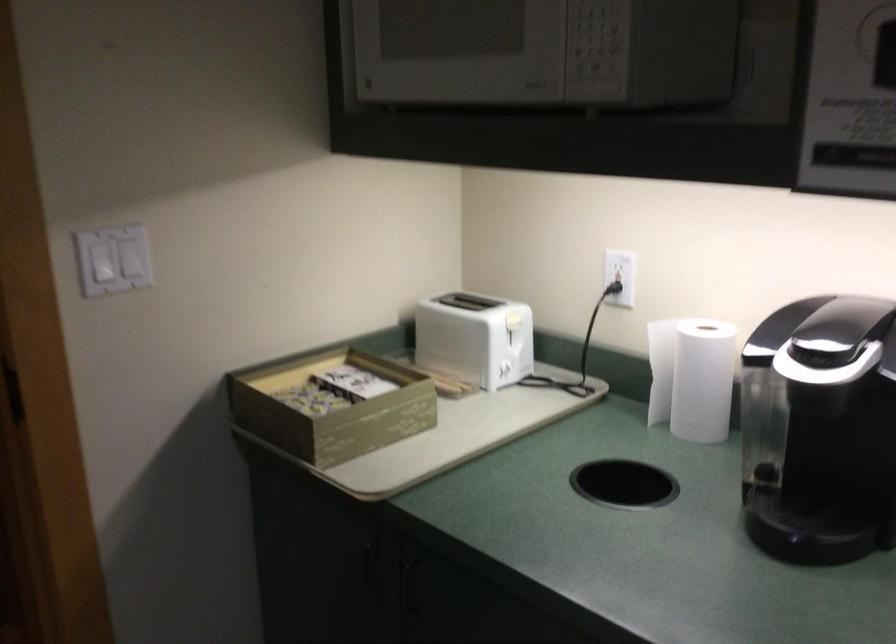
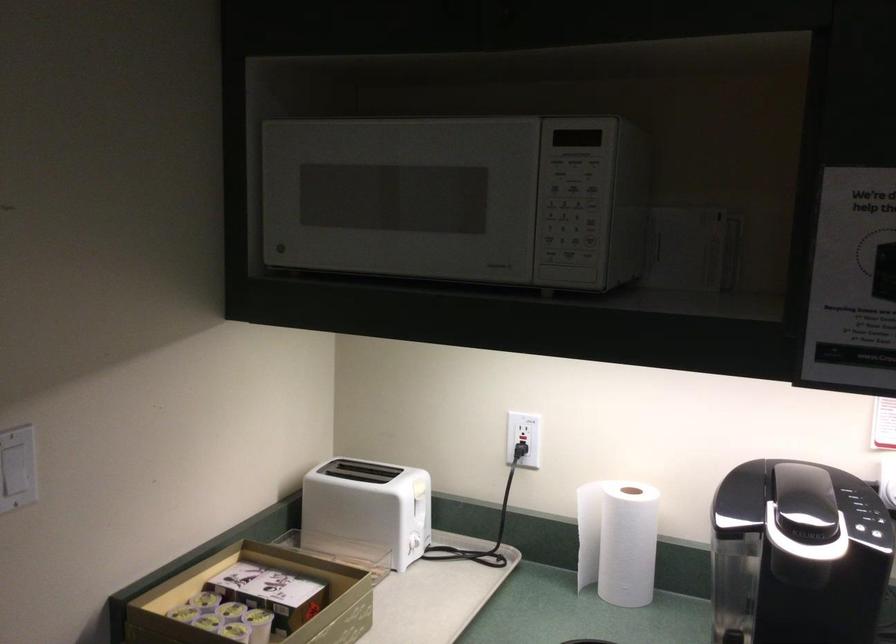
In the second image, find the point that corresponds to point 280,393 in the first image.

(183, 612)